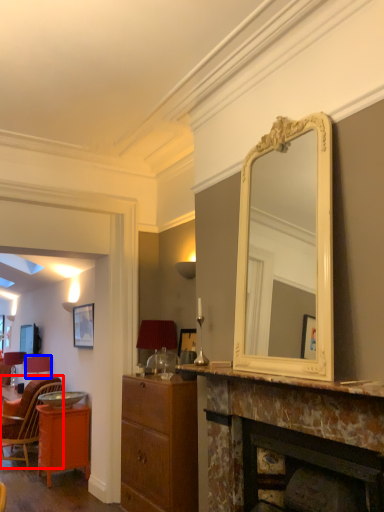
Question: Which object is further to the camera taking this photo, chair (highlighted by a red box) or lamp (highlighted by a blue box)?

Choices:
 (A) chair
 (B) lamp

Answer: (B)